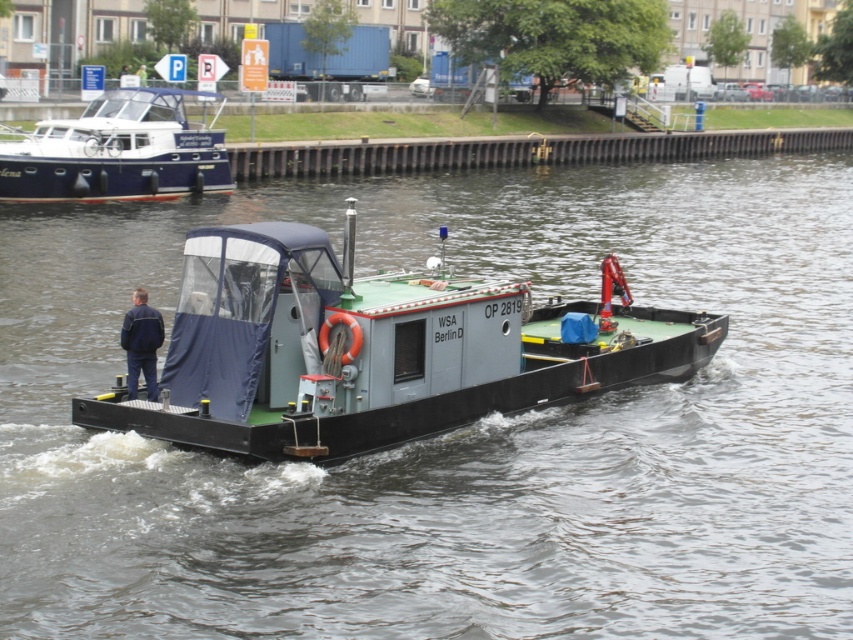
Question: Among these objects, which one is farthest from the camera?

Choices:
 (A) blue polished wood boat at upper left
 (B) gray matte barge at center
 (C) navy blue jacket at left

Answer: (A)

Question: Which point is farther to the camera?

Choices:
 (A) blue polished wood boat at upper left
 (B) navy blue jacket at left
 (C) gray matte barge at center

Answer: (A)

Question: Can you confirm if blue polished wood boat at upper left is smaller than navy blue jacket at left?

Choices:
 (A) no
 (B) yes

Answer: (A)

Question: Can you confirm if gray matte barge at center is positioned to the left of navy blue jacket at left?

Choices:
 (A) yes
 (B) no

Answer: (B)

Question: Which of the following is the closest to the observer?

Choices:
 (A) (107, 150)
 (B) (132, 365)
 (C) (714, 316)

Answer: (B)

Question: Is blue polished wood boat at upper left positioned behind navy blue jacket at left?

Choices:
 (A) no
 (B) yes

Answer: (B)